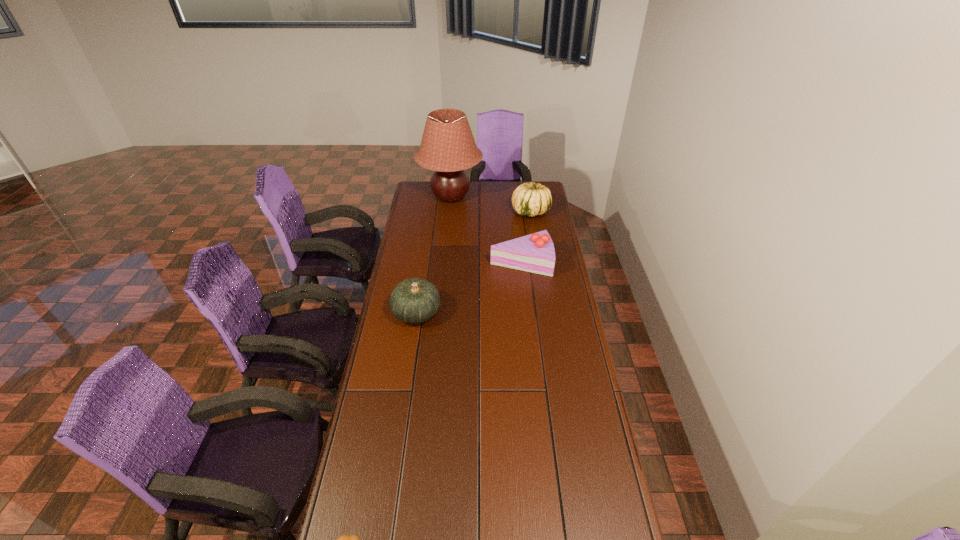
Find the location of a particular element. lampshade is located at coordinates (448, 147).

Locate an element on the screen. This screenshot has width=960, height=540. the farthest gourd is located at coordinates (531, 199).

Identify the location of the second nearest object. Image resolution: width=960 pixels, height=540 pixels. (415, 300).

Where is `the third farthest object`? This screenshot has height=540, width=960. the third farthest object is located at coordinates (535, 253).

The image size is (960, 540). What are the coordinates of `vacant space positioned 0.280m on the front-facing side of the lampshade` in the screenshot? It's located at (532, 197).

Locate an element on the screen. vacant area situated 0.230m on the left of the farthest gourd is located at coordinates (468, 212).

This screenshot has height=540, width=960. I want to click on vacant space located on the front of the second nearest object, so click(402, 407).

At what (x,y) coordinates should I click in order to perform the action: click on free region located 0.370m on the front of the cake. Please return your answer as a coordinate pair (x, y). Looking at the image, I should click on coord(529,340).

Identify the location of lampshade present at the far edge. This screenshot has width=960, height=540. (448, 147).

Image resolution: width=960 pixels, height=540 pixels. Find the location of `gourd present at the far edge`. gourd present at the far edge is located at coordinates tap(531, 199).